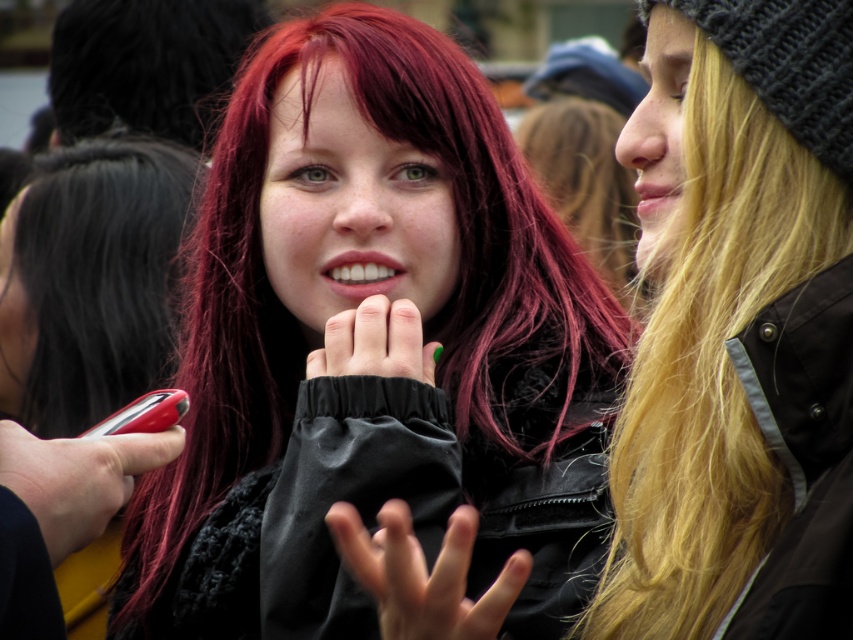
You are a photographer trying to capture a photo of the matte black jacket at center and the rubberized red phone at lower left. Which object should you zoom in on to ensure both fit in the frame without cropping?

The rubberized red phone at lower left is narrower than the matte black jacket at center, so you should zoom in on the wider matte black jacket at center to ensure both fit in the frame without cropping.

You are a photographer holding a camera and need to capture a closeup shot of both the matte black jacket at center and the shiny red phone at lower left. Given that your camera has a maximum focus range of 60 centimeters, will you be able to include both objects in the same frame without moving the camera?

The matte black jacket at center and shiny red phone at lower left are 59.36 centimeters apart from each other. Since the distance between them is within the camera maximum focus range of 60 centimeters, you can include both objects in the same frame without moving the camera.